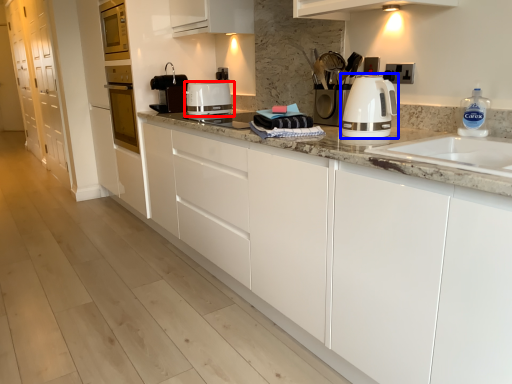
Question: Among these objects, which one is nearest to the camera, kitchen appliance (highlighted by a red box) or home appliance (highlighted by a blue box)?

Choices:
 (A) kitchen appliance
 (B) home appliance

Answer: (B)